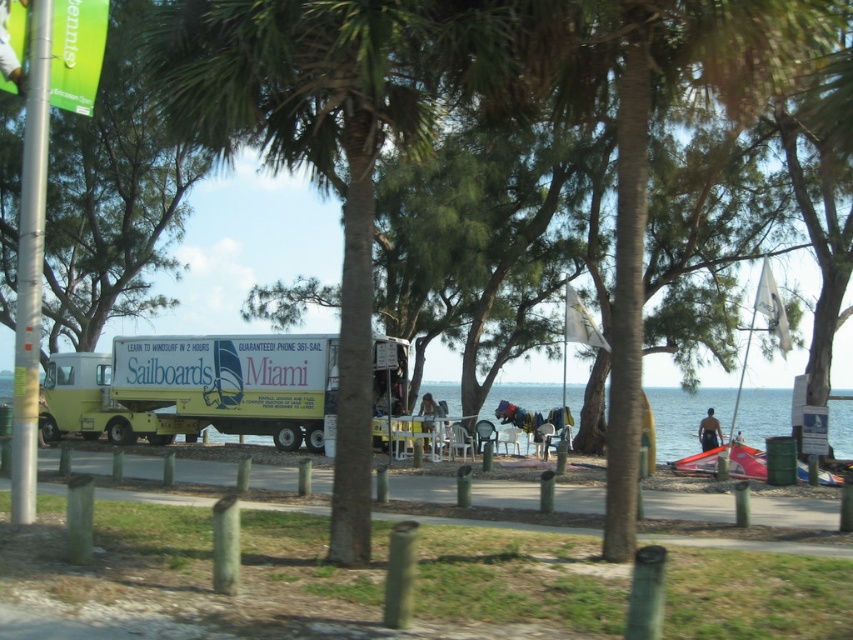
This screenshot has height=640, width=853. Describe the element at coordinates (195, 388) in the screenshot. I see `yellow matte food truck at center` at that location.

Who is positioned more to the left, yellow matte food truck at center or clear blue water at lower center?

Positioned to the left is yellow matte food truck at center.

Is point (302, 372) closer to camera compared to point (662, 444)?

Yes, point (302, 372) is closer to viewer.

Find the location of a particular element. The height and width of the screenshot is (640, 853). yellow matte food truck at center is located at coordinates tap(195, 388).

Between yellow matte food truck at center and yellow matte truck at left, which one is positioned lower?

yellow matte truck at left

Who is positioned more to the left, yellow matte food truck at center or yellow matte truck at left?

Positioned to the left is yellow matte truck at left.

Find the location of a particular element. Image resolution: width=853 pixels, height=640 pixels. yellow matte food truck at center is located at coordinates pyautogui.click(x=195, y=388).

Can you confirm if clear blue water at lower center is shorter than yellow matte truck at left?

In fact, clear blue water at lower center may be taller than yellow matte truck at left.

Does clear blue water at lower center appear over yellow matte truck at left?

No.

Does point (762, 420) come closer to viewer compared to point (128, 406)?

No, it is behind (128, 406).

The height and width of the screenshot is (640, 853). Find the location of `clear blue water at lower center`. clear blue water at lower center is located at coordinates (685, 417).